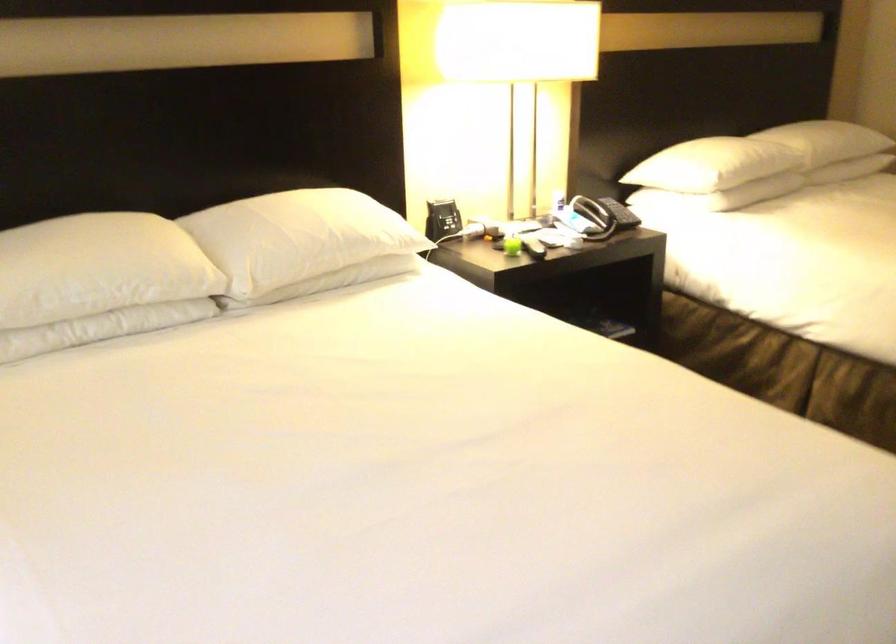
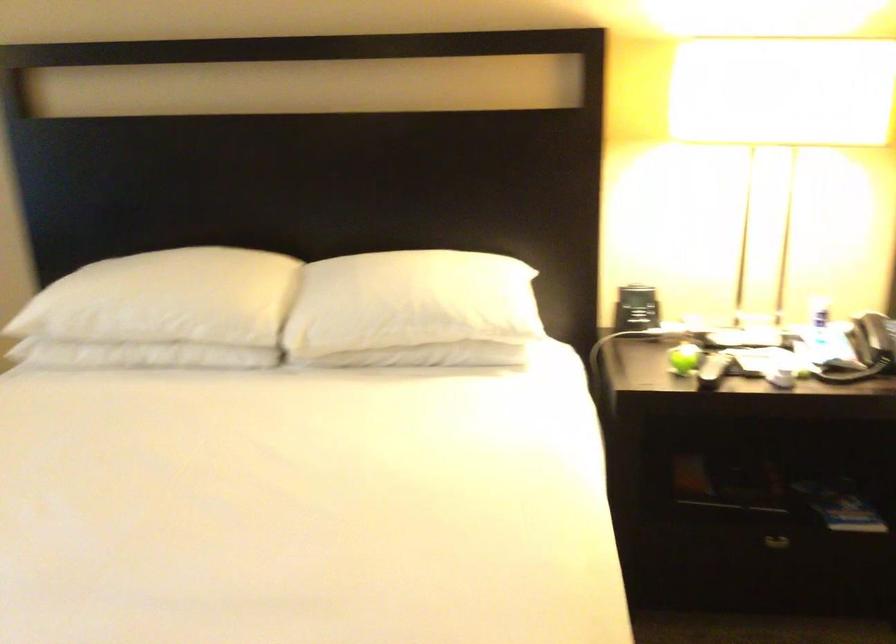
Where in the second image is the point corresponding to (x=567, y=205) from the first image?

(819, 319)